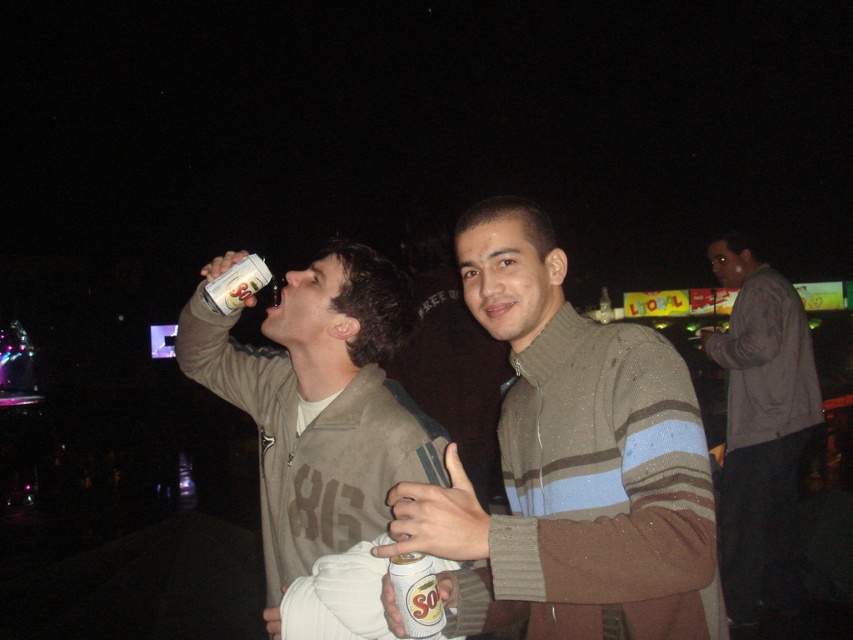
How distant is gray sweater at right from white matte can at center?

A distance of 3.53 meters exists between gray sweater at right and white matte can at center.

Where is `gray sweater at right`? gray sweater at right is located at coordinates (761, 429).

Where is `gray sweater at right`? Image resolution: width=853 pixels, height=640 pixels. gray sweater at right is located at coordinates (761, 429).

Is matte gray jacket at center below white matte can at center?

Actually, matte gray jacket at center is above white matte can at center.

Who is positioned more to the left, matte gray jacket at center or white matte can at center?

Positioned to the left is matte gray jacket at center.

Which is behind, point (329, 308) or point (407, 624)?

Point (329, 308)

Locate an element on the screen. This screenshot has width=853, height=640. matte gray jacket at center is located at coordinates (320, 406).

Which is more to the right, shiny brown sweater at center or matte gray jacket at center?

shiny brown sweater at center

Is shiny brown sweater at center positioned before matte gray jacket at center?

Yes, it is in front of matte gray jacket at center.

Image resolution: width=853 pixels, height=640 pixels. What are the coordinates of `shiny brown sweater at center` in the screenshot? It's located at (572, 464).

Where is `shiny brown sweater at center`? Image resolution: width=853 pixels, height=640 pixels. shiny brown sweater at center is located at coordinates (572, 464).